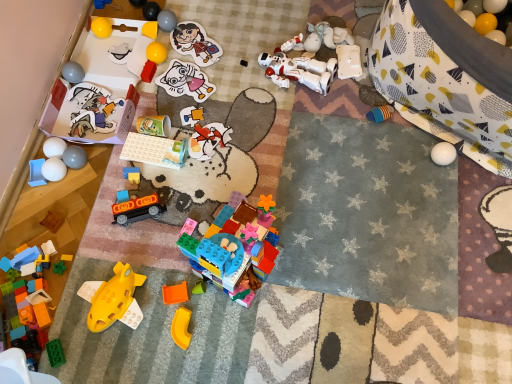
Where is `vacant space behind matte cardboard cutout at upper left, which is counted as the 15th toy, starting from the right`? The image size is (512, 384). vacant space behind matte cardboard cutout at upper left, which is counted as the 15th toy, starting from the right is located at coordinates (103, 65).